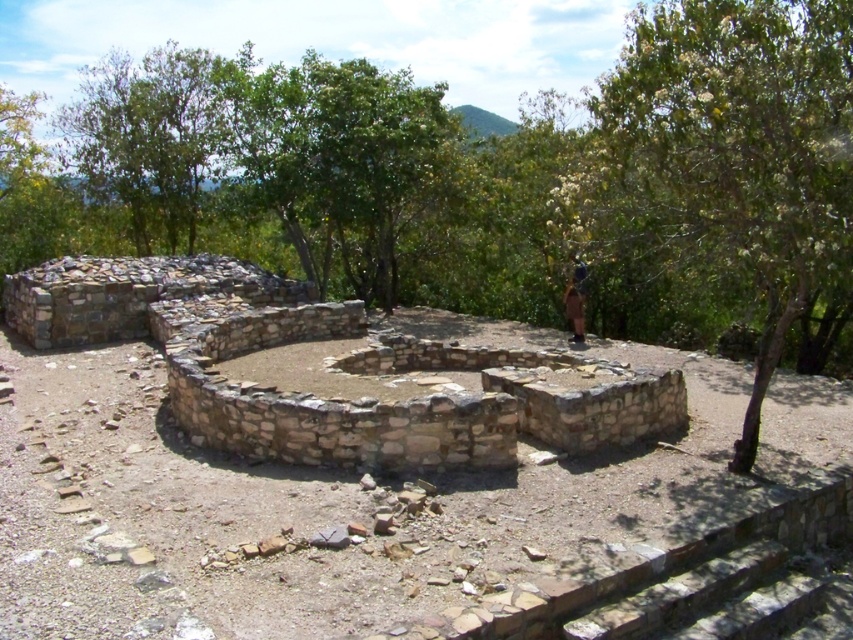
You are an archaeologist standing at the base of the stone steps leading up to the platform. You notice a green leafy tree at upper right and a brown fabric at center. Which object is closer to you?

The brown fabric at center is closer to you because it is located at the center of the scene, while the green leafy tree at upper right is positioned further away at the upper right corner. According to the description, the green leafy tree at upper right is 6.32 meters away from the brown fabric at center, so the brown fabric is nearer.

You are standing at the center of the circular stone platform in the archaeological site. Looking towards the green leafy tree at upper right, what direction should you face to see it?

The green leafy tree at upper right is located at coordinates approximately 0.233 on the x axis and 0.866 on the y axis. Since the y coordinate is closer to 1, it is positioned higher up in the image. The x coordinate of 0.233 places it slightly to the left of center. Therefore, to face the green leafy tree at upper right from the center of the platform, you should look towards the upper left direction.

You are an archaeologist examining the site. You notice the green leafy tree at upper right and the brown fabric at center. Which object is positioned to the right side of the other?

The green leafy tree at upper right is to the right of the brown fabric at center.